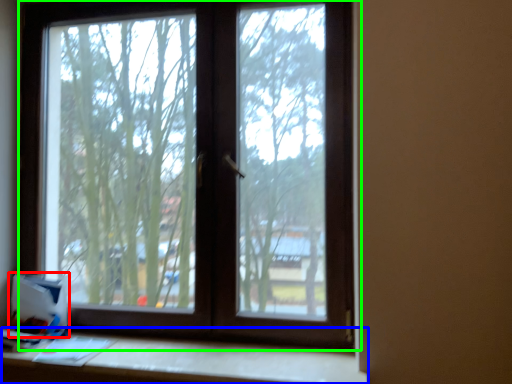
Question: Considering the real-world distances, which object is closest to cardboard box (highlighted by a red box)? table (highlighted by a blue box) or window (highlighted by a green box).

Choices:
 (A) table
 (B) window

Answer: (A)